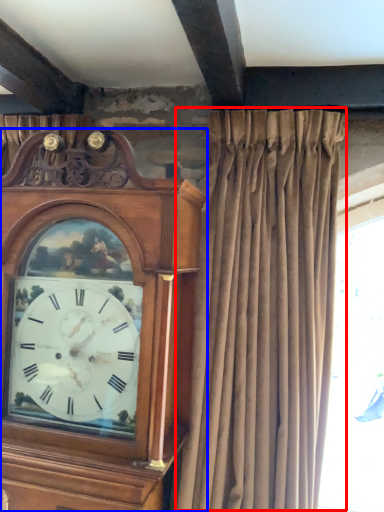
Question: Which of the following is the closest to the observer, curtain (highlighted by a red box) or clock (highlighted by a blue box)?

Choices:
 (A) curtain
 (B) clock

Answer: (A)